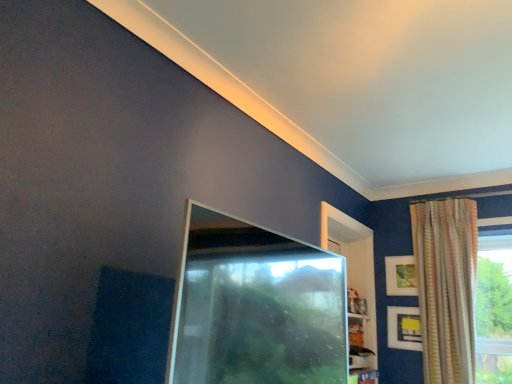
Question: Would you say striped fabric curtain at upper right is inside or outside matte gold picture frame at upper right, the 1th picture frame positioned from the top?

Choices:
 (A) outside
 (B) inside

Answer: (A)

Question: Relative to matte gold picture frame at upper right, which is counted as the 2th picture frame, starting from the bottom, is striped fabric curtain at upper right in front or behind?

Choices:
 (A) behind
 (B) front

Answer: (B)

Question: Estimate the real-world distances between objects in this image. Which object is closer to the striped fabric curtain at upper right?

Choices:
 (A) transparent glass screen door at center
 (B) matte gold picture frame at upper right, which is counted as the 2th picture frame, starting from the bottom
 (C) matte black picture frame at upper right, acting as the 2th picture frame starting from the top

Answer: (B)

Question: Which object is the farthest from the striped fabric curtain at upper right?

Choices:
 (A) transparent glass screen door at center
 (B) matte black picture frame at upper right, acting as the 2th picture frame starting from the top
 (C) matte gold picture frame at upper right, the 1th picture frame positioned from the top

Answer: (A)